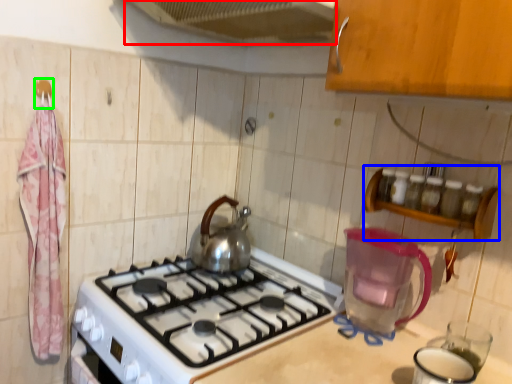
Question: Estimate the real-world distances between objects in this image. Which object is closer to exhaust hood (highlighted by a red box), shelf (highlighted by a blue box) or hanger (highlighted by a green box)?

Choices:
 (A) shelf
 (B) hanger

Answer: (B)